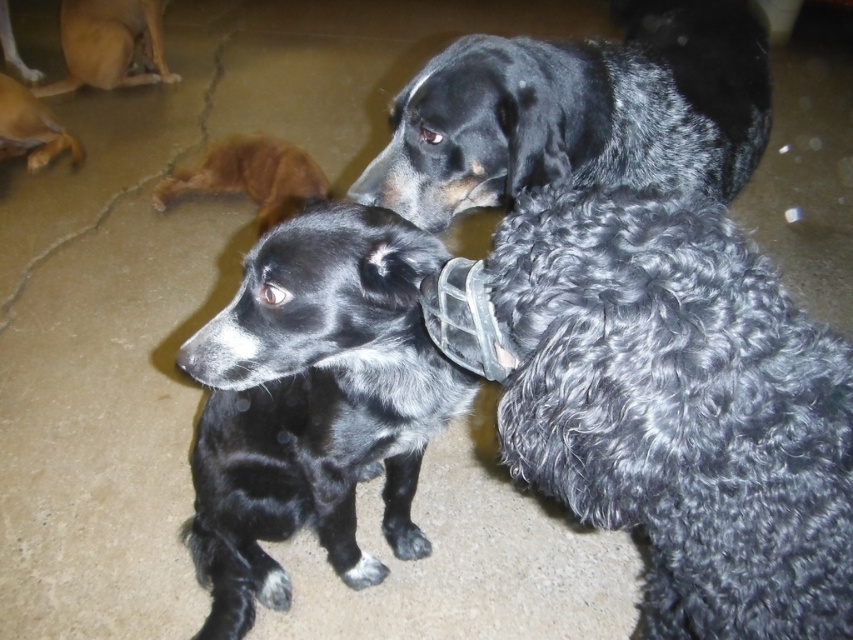
Question: Which object is positioned farthest from the brown fur at upper left?

Choices:
 (A) light brown fur at upper left
 (B) brown fur dog at upper left

Answer: (A)

Question: Is the position of black fuzzy dog at center less distant than that of brown fur dog at upper left?

Choices:
 (A) no
 (B) yes

Answer: (B)

Question: Where is curly black fur at center located in relation to light brown fur at upper left in the image?

Choices:
 (A) above
 (B) below

Answer: (B)

Question: Can you confirm if black textured fur dog at upper center is smaller than light brown fur at upper left?

Choices:
 (A) no
 (B) yes

Answer: (A)

Question: Which object appears closest to the camera in this image?

Choices:
 (A) light brown fur at upper left
 (B) black fuzzy dog at center
 (C) brown fur dog at upper left
 (D) brown fur at upper left

Answer: (B)

Question: Which point appears closest to the camera in this image?

Choices:
 (A) (318, 253)
 (B) (123, 76)
 (C) (775, 518)

Answer: (C)